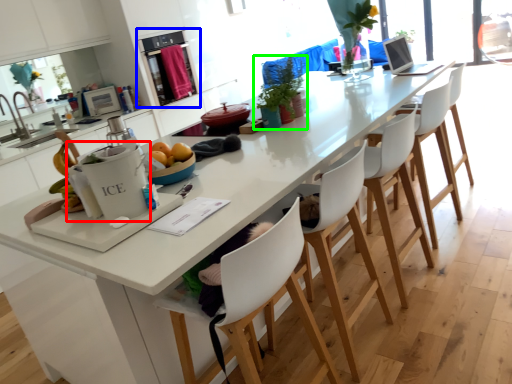
Question: Based on their relative distances, which object is farther from appliance (highlighted by a red box)? Choose from kitchen appliance (highlighted by a blue box) and houseplant (highlighted by a green box).

Choices:
 (A) kitchen appliance
 (B) houseplant

Answer: (A)